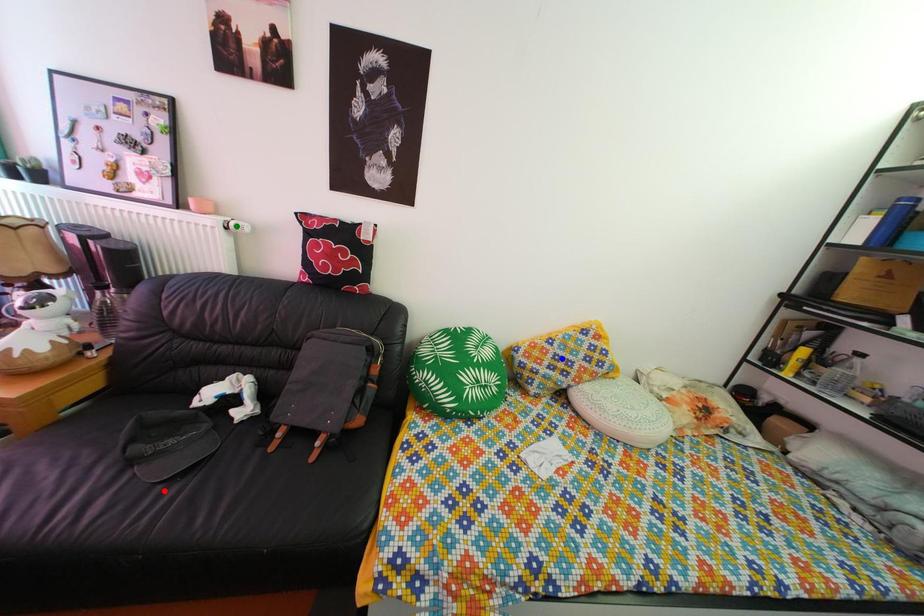
Order these from nearest to farthest:
red point | green point | blue point

red point < green point < blue point